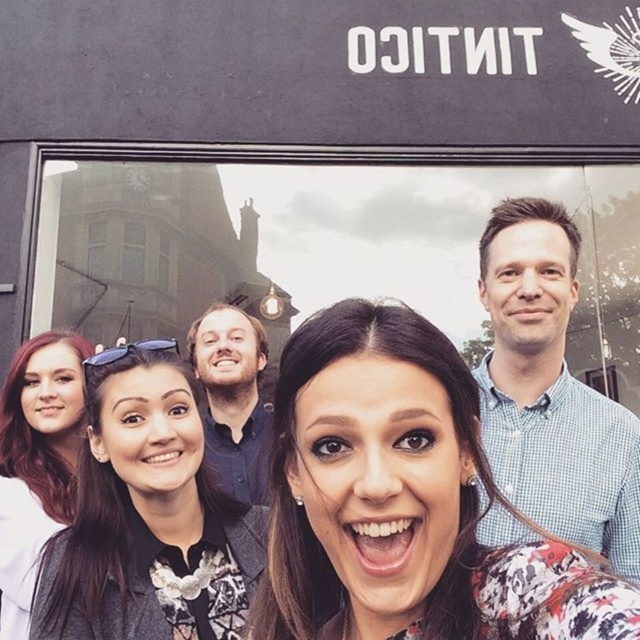
Is point (257, 531) farther from camera compared to point (26, 589)?

Yes, point (257, 531) is farther from viewer.

Which of these two, matte black jacket at center or matte black hair at left, stands shorter?

matte black jacket at center

Looking at this image, measure the distance between point (90, 586) and camera.

Point (90, 586) is 12.54 meters from camera.

You are a GUI agent. You are given a task and a screenshot of the screen. Output one action in this format:
    pyautogui.click(x=<x>, y=<y>)
    Task: Click on the matte black jacket at center
    The image size is (640, 640).
    Given the screenshot: What is the action you would take?
    pyautogui.click(x=147, y=516)

Does matte black jacket at center appear on the right side of blue checkered shirt at upper right?

No, matte black jacket at center is not to the right of blue checkered shirt at upper right.

Who is positioned more to the right, matte black jacket at center or blue checkered shirt at upper right?

From the viewer's perspective, blue checkered shirt at upper right appears more on the right side.

Between point (227, 560) and point (612, 426), which one is positioned behind?

Positioned behind is point (612, 426).

This screenshot has height=640, width=640. What are the coordinates of `matte black jacket at center` in the screenshot? It's located at (147, 516).

Is point (310, 445) positioned before point (198, 580)?

Yes, point (310, 445) is closer to viewer.

Where is `floral fabric dress at center`? floral fabric dress at center is located at coordinates (403, 500).